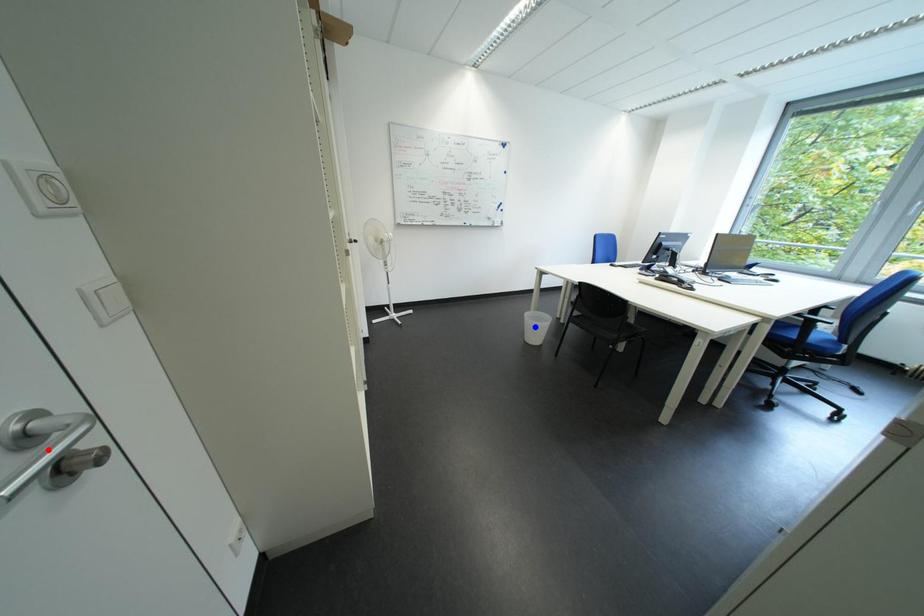
Question: Two points are marked on the image. Which point is closer to the camera?

Choices:
 (A) Blue point is closer.
 (B) Red point is closer.

Answer: (B)